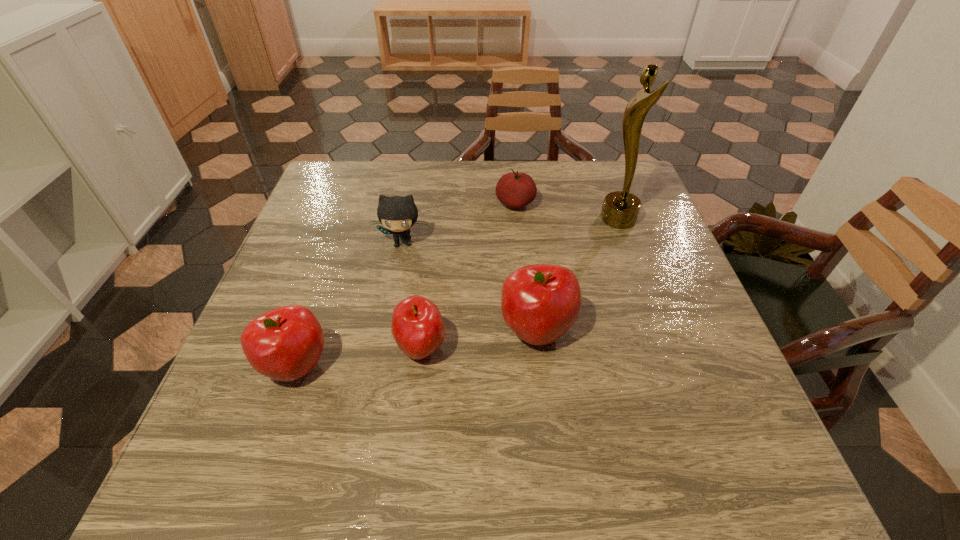
The height and width of the screenshot is (540, 960). In order to click on object positioned at the right edge in this screenshot , I will do `click(620, 209)`.

Where is `object that is at the near left corner`? This screenshot has width=960, height=540. object that is at the near left corner is located at coordinates pyautogui.click(x=285, y=344).

This screenshot has width=960, height=540. Find the location of `object located in the far right corner section of the desktop`. object located in the far right corner section of the desktop is located at coordinates (620, 209).

Identify the location of vacant space at the far edge. (578, 162).

This screenshot has height=540, width=960. I want to click on vacant space at the near edge, so click(x=307, y=407).

Image resolution: width=960 pixels, height=540 pixels. In the image, there is a desktop. Identify the location of free space at the left edge. (290, 295).

You are a GUI agent. You are given a task and a screenshot of the screen. Output one action in this format:
    pyautogui.click(x=<x>, y=<y>)
    Task: Click on the vacant space at the right edge
    The height and width of the screenshot is (540, 960).
    Given the screenshot: What is the action you would take?
    pyautogui.click(x=629, y=288)

This screenshot has height=540, width=960. In the image, there is a desktop. Identify the location of vacant space at the far left corner. (358, 199).

Where is `free point between the shortest object and the kitten`? free point between the shortest object and the kitten is located at coordinates point(459,223).

The height and width of the screenshot is (540, 960). I want to click on unoccupied area between the shortest object and the shortest apple, so click(468, 276).